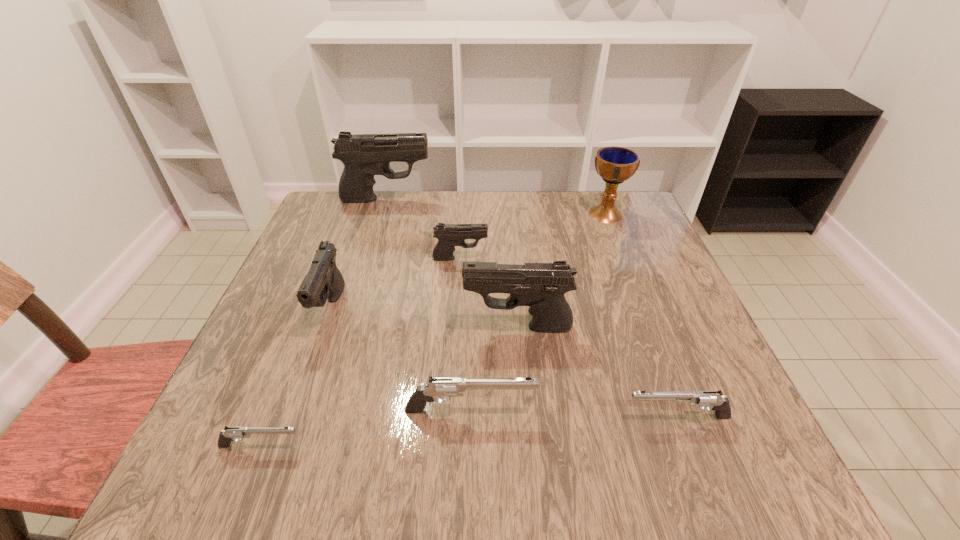
Find the location of a particular element. The image size is (960, 540). the farthest pistol is located at coordinates (364, 155).

This screenshot has height=540, width=960. Find the location of `the biggest black pistol`. the biggest black pistol is located at coordinates (364, 155).

Find the location of a particular element. blue chalice is located at coordinates (615, 165).

Identify the location of the second tallest pistol. (541, 286).

Where is `the fifth shortest object`? This screenshot has width=960, height=540. the fifth shortest object is located at coordinates (323, 281).

What are the coordinates of `the third biggest black pistol` in the screenshot? It's located at (323, 281).

Locate an element on the screen. the second farthest pistol is located at coordinates (449, 235).

I want to click on the third nearest black pistol, so click(x=449, y=235).

Where is `the second silver pistol from right to left`? The image size is (960, 540). the second silver pistol from right to left is located at coordinates (439, 387).

Image resolution: width=960 pixels, height=540 pixels. I want to click on the rightmost silver pistol, so click(713, 399).